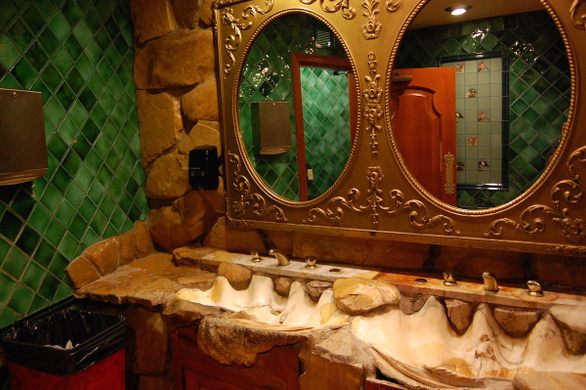
I want to click on door, so click(x=395, y=66), click(x=455, y=67), click(x=455, y=200), click(x=403, y=156).